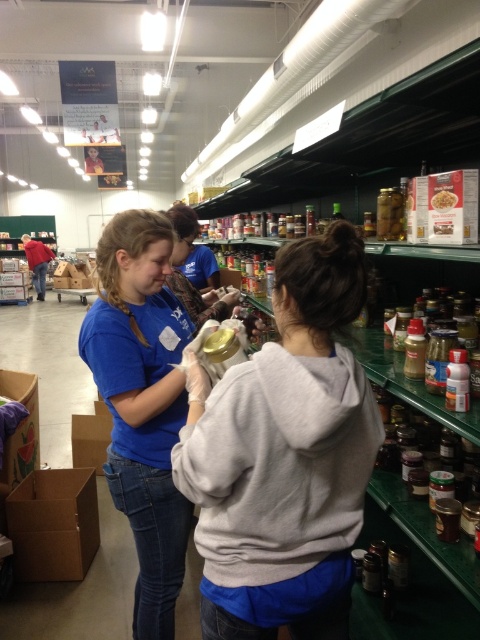
Question: Which object is positioned farthest from the matte yellow jar at center?

Choices:
 (A) green glass jar at upper right
 (B) brown cardboard box at lower left

Answer: (B)

Question: Which object appears farthest from the camera in this image?

Choices:
 (A) brown cardboard box at lower left
 (B) matte cardboard box at center
 (C) green glass jar at upper right

Answer: (A)

Question: Which object is farther from the camera taking this photo?

Choices:
 (A) brown cardboard box at lower left
 (B) green glass jar at upper right

Answer: (A)

Question: Is green glass jar at upper right smaller than matte cardboard box at center?

Choices:
 (A) yes
 (B) no

Answer: (B)

Question: In this image, where is brown cardboard box at lower left located relative to matte cardboard box at center?

Choices:
 (A) left
 (B) right

Answer: (A)

Question: Does matte yellow jar at center appear on the left side of matte cardboard box at center?

Choices:
 (A) yes
 (B) no

Answer: (A)